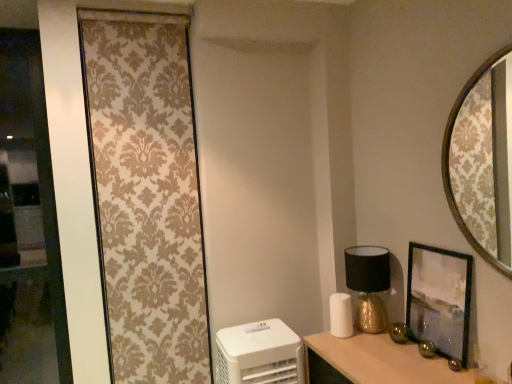
The image size is (512, 384). I want to click on white plastic air purifier at lower left, so click(x=260, y=354).

Image resolution: width=512 pixels, height=384 pixels. What do you see at coordinates (439, 299) in the screenshot?
I see `matte black picture frame at right` at bounding box center [439, 299].

The image size is (512, 384). What do you see at coordinates (368, 285) in the screenshot?
I see `black matte/golden table lamp at right` at bounding box center [368, 285].

You are a GUI agent. You are given a task and a screenshot of the screen. Output one action in this format:
    pyautogui.click(x=<x>, y=<y>)
    Task: Click on the beige damask curtain at left
    The height and width of the screenshot is (384, 512).
    Given the screenshot: What is the action you would take?
    pyautogui.click(x=147, y=195)

I want to click on appliance that appears behind the matte black picture frame at right, so click(x=260, y=354).

Is matte black picture frame at right situated inside white plastic air purifier at lower left or outside?

matte black picture frame at right exists outside the volume of white plastic air purifier at lower left.

Which object is wider, matte black picture frame at right or white plastic air purifier at lower left?

Wider between the two is white plastic air purifier at lower left.

Considering the relative sizes of matte black picture frame at right and white plastic air purifier at lower left in the image provided, is matte black picture frame at right bigger than white plastic air purifier at lower left?

No, matte black picture frame at right is not bigger than white plastic air purifier at lower left.

Is transparent glass door at left facing towards white plastic air purifier at lower left?

No, transparent glass door at left is not facing towards white plastic air purifier at lower left.

Does transparent glass door at left appear on the right side of white plastic air purifier at lower left?

Incorrect, transparent glass door at left is not on the right side of white plastic air purifier at lower left.

Considering the positions of points (24, 88) and (300, 381), is point (24, 88) farther from camera compared to point (300, 381)?

Yes.

Looking at this image, what's the angular difference between wooden frame mirror at upper right and matte black picture frame at right's facing directions?

wooden frame mirror at upper right and matte black picture frame at right are facing 0.534 degrees away from each other.

From a real-world perspective, is wooden frame mirror at upper right physically located above or below matte black picture frame at right?

wooden frame mirror at upper right is above matte black picture frame at right.

Which object is wider, wooden frame mirror at upper right or matte black picture frame at right?

With larger width is matte black picture frame at right.

Is wooden frame mirror at upper right facing away from matte black picture frame at right?

That's not correct — wooden frame mirror at upper right is not looking away from matte black picture frame at right.

In the scene shown: Between transparent glass door at left and beige damask curtain at left, which one has less height?

Standing shorter between the two is transparent glass door at left.

From a real-world perspective, which is physically below, transparent glass door at left or beige damask curtain at left?

From a 3D spatial view, beige damask curtain at left is below.

Considering the sizes of objects transparent glass door at left and beige damask curtain at left in the image provided, who is bigger, transparent glass door at left or beige damask curtain at left?

transparent glass door at left.

Can you tell me how much white plastic air purifier at lower left and matte black picture frame at right differ in facing direction?

The facing directions of white plastic air purifier at lower left and matte black picture frame at right are 86.5 degrees apart.

Are white plastic air purifier at lower left and matte black picture frame at right far apart?

No.

From a real-world perspective, is white plastic air purifier at lower left on top of matte black picture frame at right?

Incorrect, from a real-world perspective, white plastic air purifier at lower left is lower than matte black picture frame at right.

Can you confirm if wooden frame mirror at upper right is taller than beige damask curtain at left?

No, wooden frame mirror at upper right is not taller than beige damask curtain at left.

Is beige damask curtain at left at the back of wooden frame mirror at upper right?

No, wooden frame mirror at upper right is not facing away from beige damask curtain at left.

Looking at this image, can we say wooden frame mirror at upper right lies outside beige damask curtain at left?

wooden frame mirror at upper right lies outside beige damask curtain at left's area.

Does white plastic air purifier at lower left come in front of black matte/golden table lamp at right?

Yes.

From a real-world perspective, is white plastic air purifier at lower left on black matte/golden table lamp at right?

Actually, white plastic air purifier at lower left is physically below black matte/golden table lamp at right in the real world.

Do you think white plastic air purifier at lower left is within black matte/golden table lamp at right, or outside of it?

The correct answer is: outside.

Where is `picture frame located above the white plastic air purifier at lower left (from the image's perspective)`? picture frame located above the white plastic air purifier at lower left (from the image's perspective) is located at coordinates (439, 299).

The width and height of the screenshot is (512, 384). Identify the location of appliance lying below the transparent glass door at left (from the image's perspective). (260, 354).

Looking at the image, which one is located further to transparent glass door at left, beige damask curtain at left or white plastic air purifier at lower left?

The object further to transparent glass door at left is white plastic air purifier at lower left.

When comparing their distances from wooden frame mirror at upper right, does beige damask curtain at left or black matte/golden table lamp at right seem closer?

Based on the image, black matte/golden table lamp at right appears to be nearer to wooden frame mirror at upper right.

Based on their spatial positions, is matte black picture frame at right or wooden frame mirror at upper right further from beige damask curtain at left?

wooden frame mirror at upper right is positioned further to the anchor beige damask curtain at left.

Considering their positions, is transparent glass door at left positioned closer to wooden frame mirror at upper right than black matte/golden table lamp at right?

black matte/golden table lamp at right.

Which object lies further to the anchor point wooden frame mirror at upper right, matte black picture frame at right or transparent glass door at left?

Based on the image, transparent glass door at left appears to be further to wooden frame mirror at upper right.

When comparing their distances from black matte/golden table lamp at right, does matte black picture frame at right or white plastic air purifier at lower left seem closer?

matte black picture frame at right is positioned closer to the anchor black matte/golden table lamp at right.

Estimate the real-world distances between objects in this image. Which object is further from black matte/golden table lamp at right, matte black picture frame at right or beige damask curtain at left?

beige damask curtain at left lies further to black matte/golden table lamp at right than the other object.

Estimate the real-world distances between objects in this image. Which object is closer to beige damask curtain at left, transparent glass door at left or black matte/golden table lamp at right?

transparent glass door at left is closer to beige damask curtain at left.

This screenshot has width=512, height=384. I want to click on appliance between beige damask curtain at left and matte black picture frame at right from left to right, so click(260, 354).

Image resolution: width=512 pixels, height=384 pixels. What are the coordinates of `appliance between transparent glass door at left and wooden frame mirror at upper right in the horizontal direction` in the screenshot? It's located at (260, 354).

Identify the location of curtain located between transparent glass door at left and black matte/golden table lamp at right in the left-right direction. (147, 195).

This screenshot has width=512, height=384. What are the coordinates of `table lamp between transparent glass door at left and wooden frame mirror at upper right from left to right` in the screenshot? It's located at (368, 285).